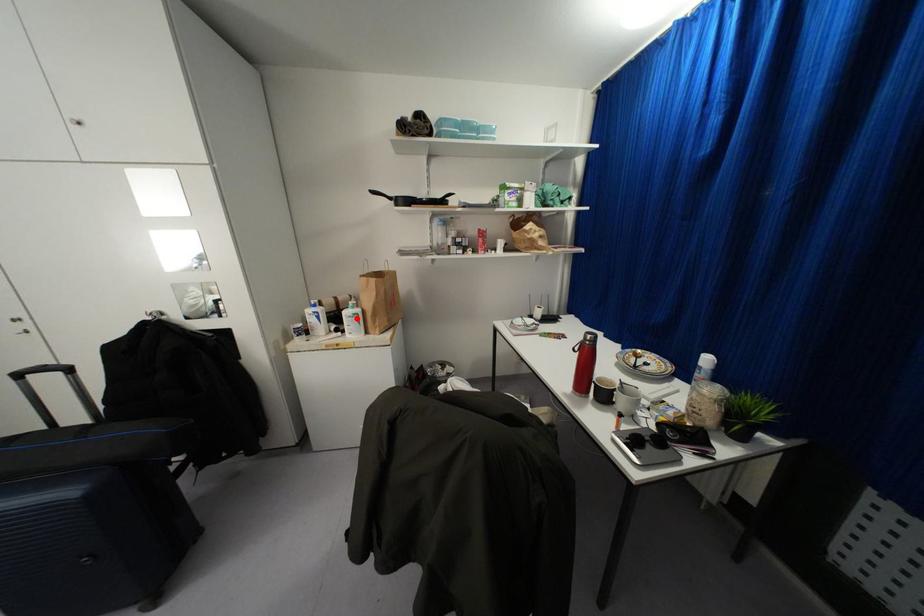
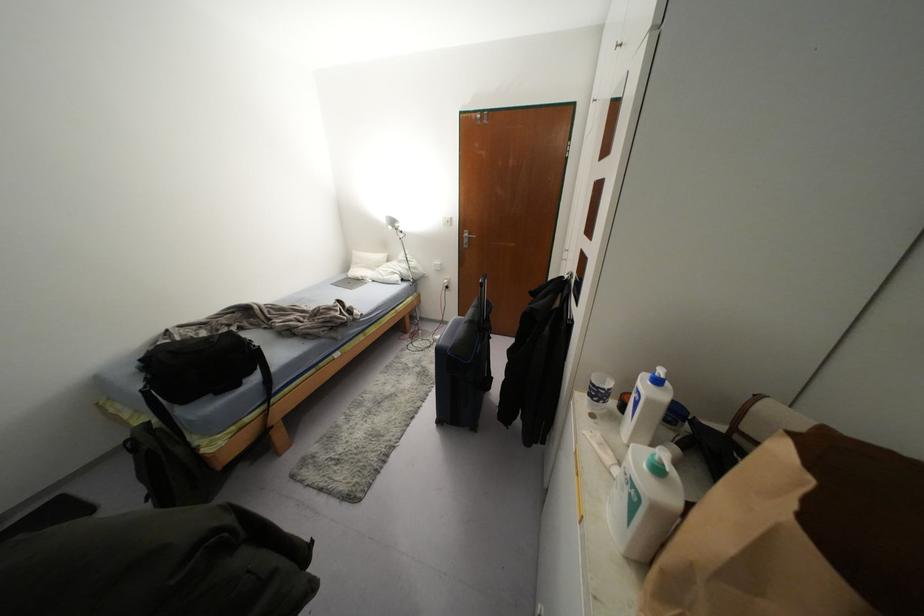
Find the pixel in the second image that matches the highlighted location in the first image.

(633, 505)